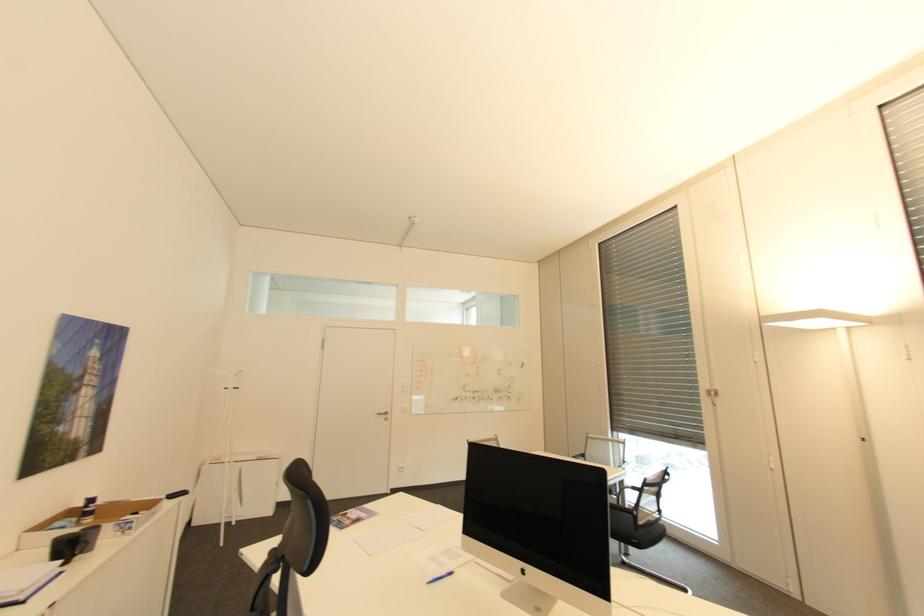
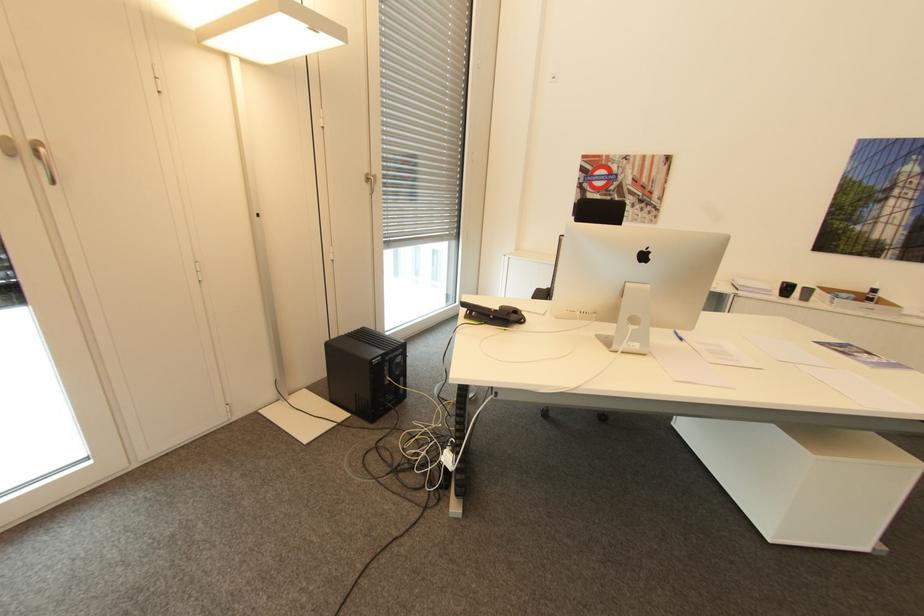
Where in the second image is the point corresponding to (x=99, y=499) from the first image?

(879, 290)